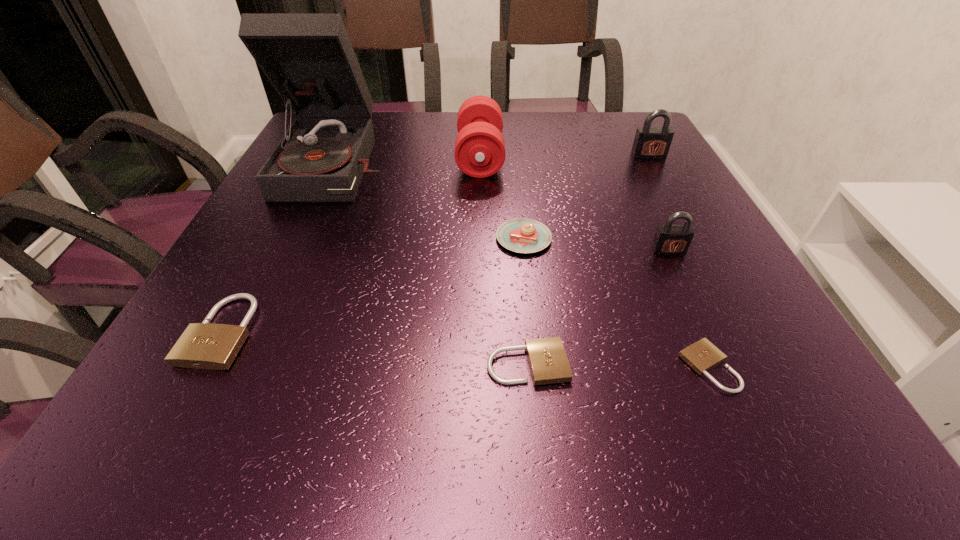
Identify the location of phonograph_record. This screenshot has width=960, height=540. (308, 58).

Where is `the bigger gray padlock`? Image resolution: width=960 pixels, height=540 pixels. the bigger gray padlock is located at coordinates (650, 142).

Where is `the tallest padlock`? the tallest padlock is located at coordinates (650, 142).

Find the location of a particular element. This screenshot has height=540, width=960. dumbbell is located at coordinates (479, 152).

At what (x,y) coordinates should I click in order to perform the action: click on the fourth tallest object. Please return your answer as a coordinate pair (x, y). The width and height of the screenshot is (960, 540). Looking at the image, I should click on pos(669,239).

This screenshot has height=540, width=960. In order to click on the nearer gray padlock in this screenshot , I will do `click(669, 239)`.

Identify the location of pastry. Image resolution: width=960 pixels, height=540 pixels. (521, 235).

Find the location of a particular element. The width and height of the screenshot is (960, 540). the third shortest padlock is located at coordinates (205, 345).

Image resolution: width=960 pixels, height=540 pixels. In order to click on the leftmost padlock in this screenshot , I will do `click(205, 345)`.

Identify the location of the fourth padlock from right to left. (548, 362).